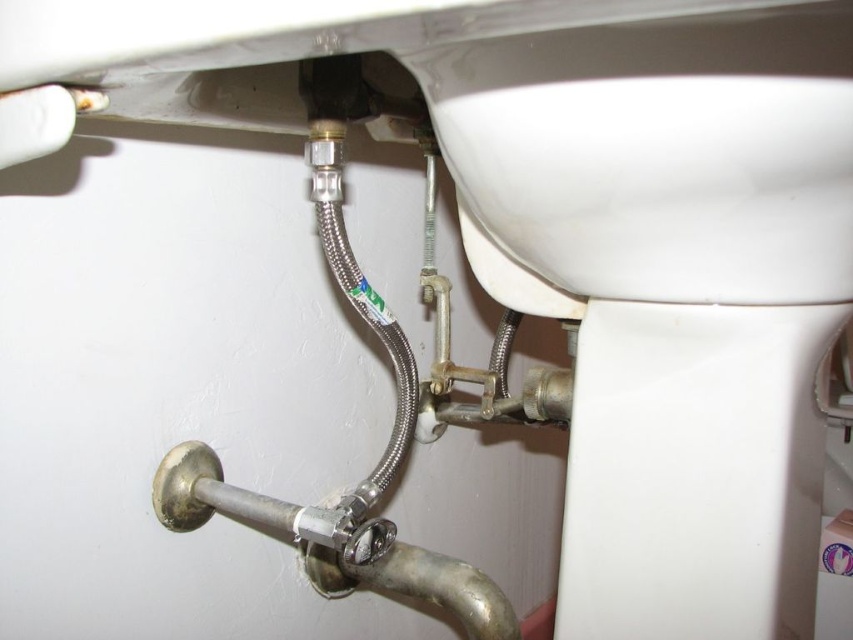
Question: Among these objects, which one is farthest from the camera?

Choices:
 (A) silver metallic pipe at center
 (B) white glossy sink at upper center

Answer: (A)

Question: Which of the following is the closest to the observer?

Choices:
 (A) silver metallic pipe at center
 (B) white glossy sink at upper center

Answer: (B)

Question: Can you confirm if white glossy sink at upper center is positioned to the left of silver metallic pipe at center?

Choices:
 (A) yes
 (B) no

Answer: (B)

Question: Is white glossy sink at upper center smaller than silver metallic pipe at center?

Choices:
 (A) yes
 (B) no

Answer: (A)

Question: Is white glossy sink at upper center above silver metallic pipe at center?

Choices:
 (A) no
 (B) yes

Answer: (B)